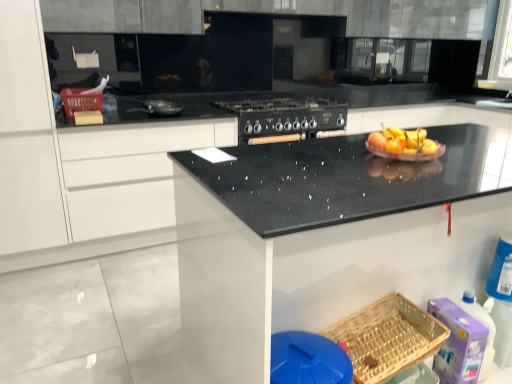
Question: Is shiny silver frying pan at center, which is counted as the first appliance, starting from the left, at the back of black speckled granite at center?

Choices:
 (A) no
 (B) yes

Answer: (B)

Question: From a real-world perspective, is black speckled granite at center over shiny silver frying pan at center, the second appliance in the back-to-front sequence?

Choices:
 (A) yes
 (B) no

Answer: (B)

Question: Is black speckled granite at center at the right side of shiny silver frying pan at center, which is counted as the first appliance, starting from the left?

Choices:
 (A) yes
 (B) no

Answer: (A)

Question: Is black speckled granite at center oriented towards shiny silver frying pan at center, the second appliance in the back-to-front sequence?

Choices:
 (A) yes
 (B) no

Answer: (B)

Question: Can you see black speckled granite at center touching shiny silver frying pan at center, which ranks as the 1th appliance in front-to-back order?

Choices:
 (A) yes
 (B) no

Answer: (B)

Question: Looking at their shapes, would you say shiny silver frying pan at center, which is counted as the first appliance, starting from the left, is wider or thinner than woven wood basket at lower right, the 1th basket from the bottom?

Choices:
 (A) thin
 (B) wide

Answer: (A)

Question: Is point (157, 105) closer or farther from the camera than point (391, 292)?

Choices:
 (A) farther
 (B) closer

Answer: (A)

Question: Is shiny silver frying pan at center, which ranks as the 1th appliance in front-to-back order, in front of or behind woven wood basket at lower right, the 1th basket from the bottom, in the image?

Choices:
 (A) behind
 (B) front

Answer: (A)

Question: Looking at the image, does shiny silver frying pan at center, the second appliance in the back-to-front sequence, seem bigger or smaller compared to woven wood basket at lower right, which is the second basket from left to right?

Choices:
 (A) big
 (B) small

Answer: (B)

Question: Is purple plastic cleaning product at lower right wider or thinner than black speckled granite at center?

Choices:
 (A) thin
 (B) wide

Answer: (A)

Question: Is purple plastic cleaning product at lower right in front of or behind black speckled granite at center in the image?

Choices:
 (A) front
 (B) behind

Answer: (B)

Question: Is purple plastic cleaning product at lower right to the left or to the right of black speckled granite at center in the image?

Choices:
 (A) left
 (B) right

Answer: (B)

Question: Would you say purple plastic cleaning product at lower right is inside or outside black speckled granite at center?

Choices:
 (A) outside
 (B) inside

Answer: (B)

Question: Relative to woven wood basket at lower right, which is the second basket from left to right, is translucent glass bowl at center in front or behind?

Choices:
 (A) front
 (B) behind

Answer: (B)

Question: From the image's perspective, relative to woven wood basket at lower right, arranged as the second basket when viewed from the top, is translucent glass bowl at center above or below?

Choices:
 (A) below
 (B) above

Answer: (B)